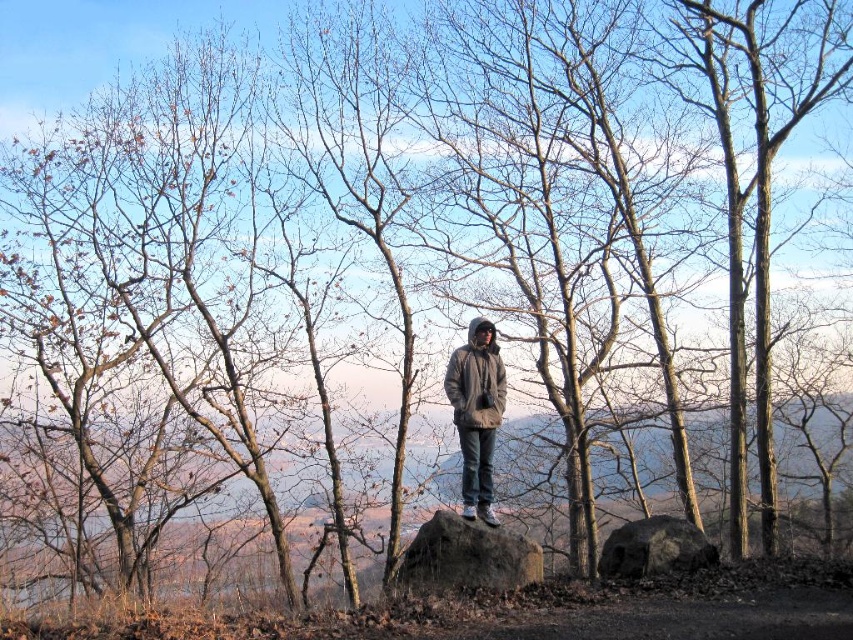
Question: Which of the following is the closest to the observer?

Choices:
 (A) click(451, 568)
 (B) click(660, 524)

Answer: (A)

Question: Does dark gray rock at center appear over gray woolen jacket at center?

Choices:
 (A) no
 (B) yes

Answer: (A)

Question: Which object is farther from the camera taking this photo?

Choices:
 (A) gray woolen jacket at center
 (B) dark gray rock at center
 (C) brown rough boulder at center

Answer: (A)

Question: Can you confirm if brown rough boulder at center is positioned to the left of dark gray rock at center?

Choices:
 (A) yes
 (B) no

Answer: (A)

Question: Which point is closer to the camera?

Choices:
 (A) brown rough boulder at center
 (B) dark gray rock at center
 (C) gray woolen jacket at center

Answer: (A)

Question: Is dark gray rock at center closer to the viewer compared to gray woolen jacket at center?

Choices:
 (A) no
 (B) yes

Answer: (B)